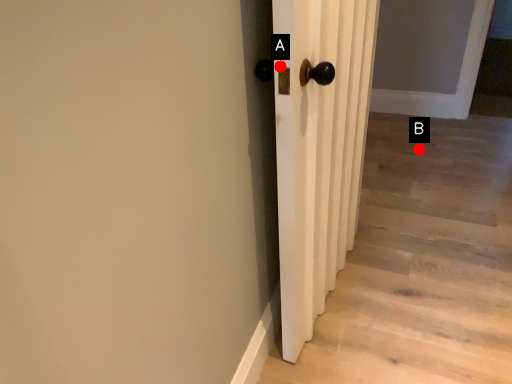
Question: Two points are circled on the image, labeled by A and B beside each circle. Among these points, which one is farthest from the camera?

Choices:
 (A) A is further
 (B) B is further

Answer: (B)